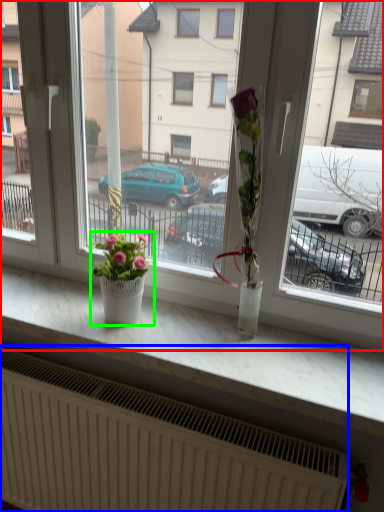
Question: Which is nearer to the window (highlighted by a red box)? radiator (highlighted by a blue box) or houseplant (highlighted by a green box).

Choices:
 (A) radiator
 (B) houseplant

Answer: (B)